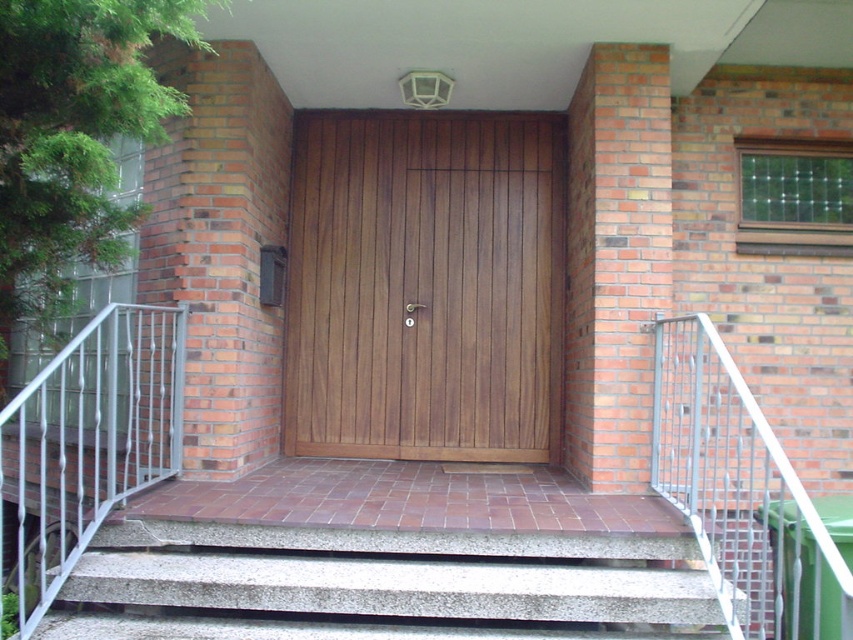
You are standing at the entrance of the brick building and want to go down the steps. Which direction should you walk to reach the gray concrete stairs at lower left?

You should walk towards the lower left direction to reach the gray concrete stairs at lower left since they are located at point coordinates of (380, 586) which is in the lower left area of the image.

You are standing at the entrance of the brick building and want to walk down to the street level. The gray concrete stairs at lower left are located at point (380,586). Can you confirm if the stairs are on your left side when facing the door?

Yes, the gray concrete stairs at lower left located at point (380,586) are on your left side when facing the door.